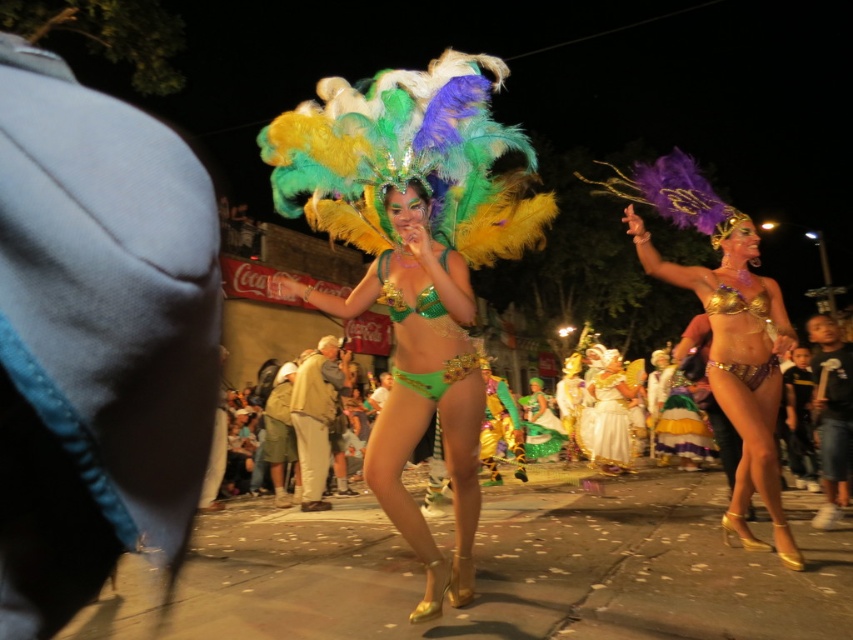
Looking at the festive parade scene, which object takes up more horizontal space in the image between the green sequined bikini at center and the multicolored sequined skirt at center?

The multicolored sequined skirt at center takes up more horizontal space than the green sequined bikini at center because it has a greater width according to the description.

You are a photographer at the carnival trying to capture both the green metallic bikini at center and the gold metallic bikini at center in a single frame. The camera lens can only focus on objects within a 30 cm width. Can both bikinis fit in the frame if you position them side by side?

The green metallic bikini at center is wider than the gold metallic bikini at center. Since the total width of both bikinis combined would exceed the camera lens focus range of 30 cm, they cannot both fit in the frame side by side.

Where is the gold metallic bikini at center located in the image?

The gold metallic bikini at center is located at point (741, 333).